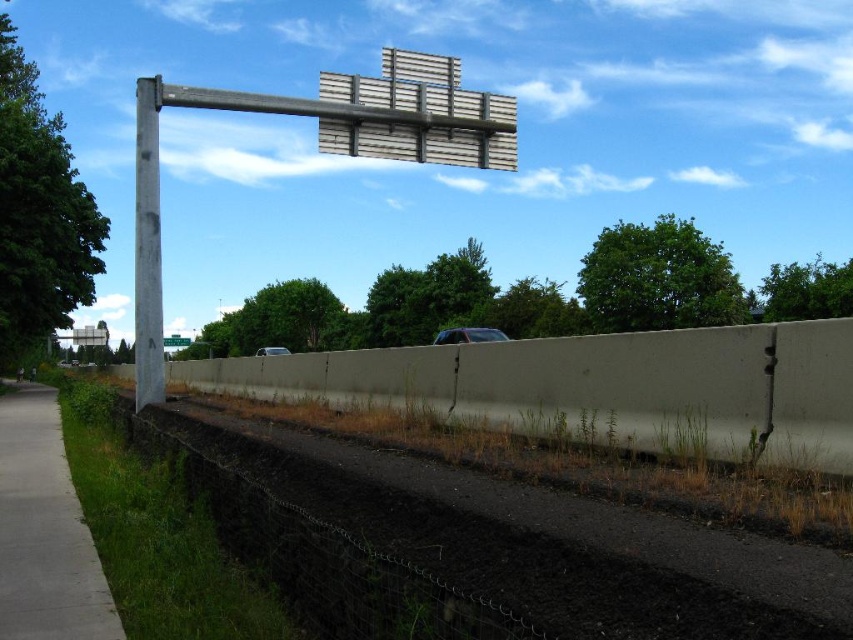
Does gray metallic pole at upper center have a smaller size compared to gray concrete sidewalk at lower left?

No, gray metallic pole at upper center is not smaller than gray concrete sidewalk at lower left.

Who is more forward, (202, 99) or (15, 417)?

Point (202, 99)

Locate an element on the screen. The height and width of the screenshot is (640, 853). gray metallic pole at upper center is located at coordinates (320, 150).

The image size is (853, 640). Identify the location of gray metallic pole at upper center. (320, 150).

How much distance is there between gray metallic pole at upper center and shiny black car at center?

The distance of gray metallic pole at upper center from shiny black car at center is 61.06 feet.

Does gray metallic pole at upper center have a larger size compared to shiny black car at center?

Indeed, gray metallic pole at upper center has a larger size compared to shiny black car at center.

Is point (323, 136) closer to viewer compared to point (502, 336)?

Yes, point (323, 136) is in front of point (502, 336).

This screenshot has height=640, width=853. What are the coordinates of `gray metallic pole at upper center` in the screenshot? It's located at (320, 150).

Who is positioned more to the right, dull gray asphalt at lower center or shiny black car at center?

From the viewer's perspective, shiny black car at center appears more on the right side.

Is point (770, 540) positioned behind point (461, 336)?

That is False.

Does point (543, 618) come farther from viewer compared to point (454, 330)?

No, it is in front of (454, 330).

You are a GUI agent. You are given a task and a screenshot of the screen. Output one action in this format:
    pyautogui.click(x=<x>, y=<y>)
    Task: Click on the dull gray asphalt at lower center
    This screenshot has height=640, width=853.
    Given the screenshot: What is the action you would take?
    pyautogui.click(x=540, y=541)